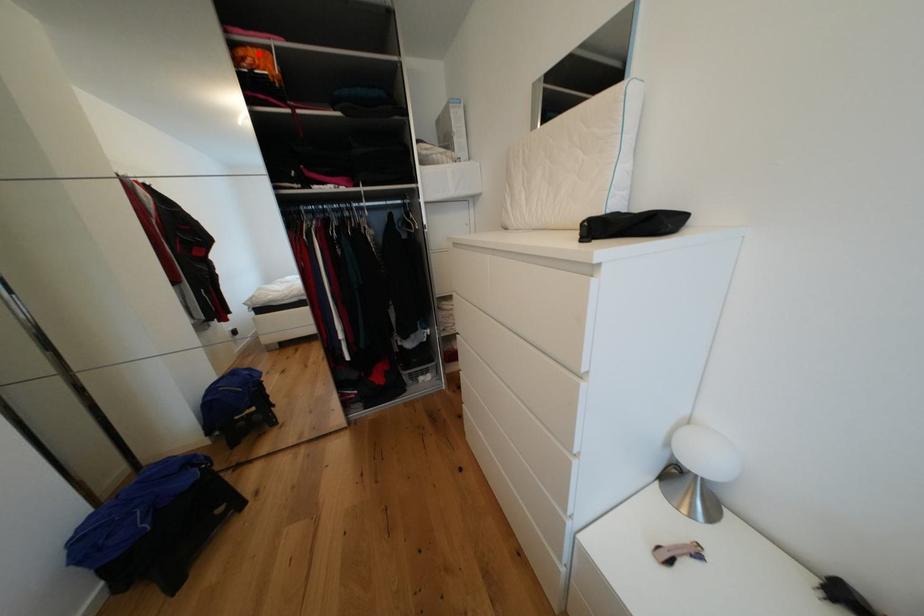
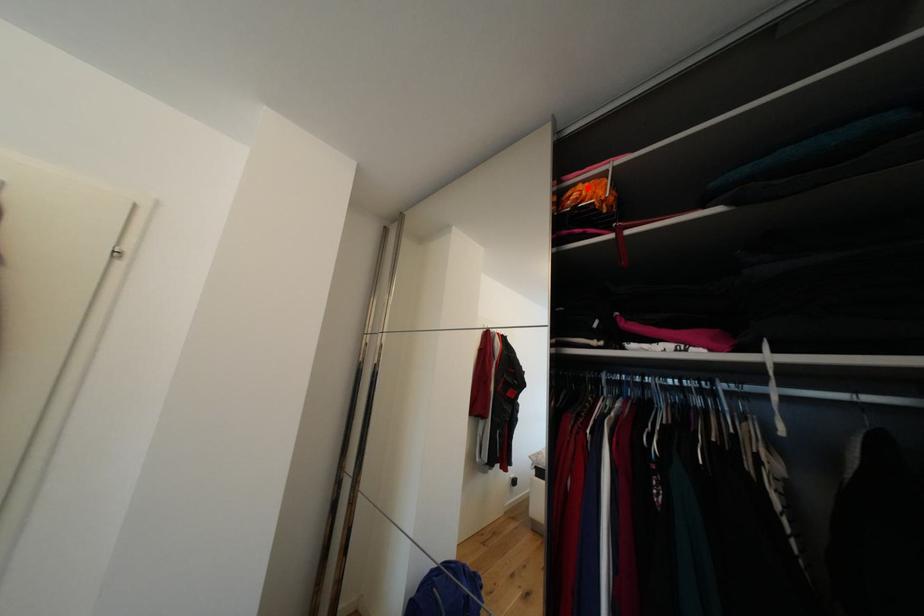
I am providing you with two images of the same scene from different viewpoints. A red point is marked on the first image and another point is marked on the second image. Is the marked point in image1 the same physical position as the marked point in image2?

Yes